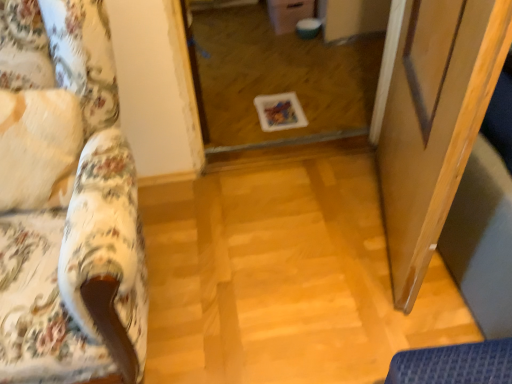
You are a GUI agent. You are given a task and a screenshot of the screen. Output one action in this format:
    pyautogui.click(x=<x>, y=<y>)
    Task: Click on the transparent glass screen door at right
    This screenshot has width=512, height=384.
    Given the screenshot: What is the action you would take?
    pyautogui.click(x=434, y=123)

Describe the element at coordinates (434, 123) in the screenshot. I see `transparent glass screen door at right` at that location.

The image size is (512, 384). In order to click on floral fabric couch at left in this screenshot , I will do `click(64, 196)`.

Where is `transparent glass screen door at right`? This screenshot has height=384, width=512. transparent glass screen door at right is located at coordinates (434, 123).

Does floral fabric couch at left contain transparent glass door at center?

Actually, transparent glass door at center is outside floral fabric couch at left.

Would you say floral fabric couch at left is a long distance from transparent glass door at center?

Yes.

In the scene shown: Looking at their sizes, would you say floral fabric couch at left is wider or thinner than transparent glass door at center?

In the image, floral fabric couch at left appears to be more narrow than transparent glass door at center.

In the scene shown: From the image's perspective, between floral fabric couch at left and transparent glass door at center, which one is located above?

transparent glass door at center, from the image's perspective.

Is transparent glass screen door at right wider than floral fabric couch at left?

No.

From a real-world perspective, is transparent glass screen door at right positioned under floral fabric couch at left based on gravity?

Correct, in the physical world, transparent glass screen door at right is lower than floral fabric couch at left.

How different are the orientations of transparent glass screen door at right and floral fabric couch at left in degrees?

transparent glass screen door at right and floral fabric couch at left are facing 104 degrees away from each other.

Considering the points (497, 20) and (75, 373), which point is in front, point (497, 20) or point (75, 373)?

Positioned in front is point (497, 20).

How far apart are transparent glass screen door at right and transparent glass door at center?

transparent glass screen door at right and transparent glass door at center are 36.99 inches apart.

Is transparent glass screen door at right oriented away from transparent glass door at center?

No, transparent glass screen door at right's orientation is not away from transparent glass door at center.

Is transparent glass screen door at right wider or thinner than transparent glass door at center?

Clearly, transparent glass screen door at right has less width compared to transparent glass door at center.

From a real-world perspective, is transparent glass screen door at right located higher than transparent glass door at center?

Yes, from a real-world perspective, transparent glass screen door at right is above transparent glass door at center.

Can you confirm if floral fabric couch at left is wider than transparent glass screen door at right?

Correct, the width of floral fabric couch at left exceeds that of transparent glass screen door at right.

Is floral fabric couch at left positioned with its back to transparent glass screen door at right?

No, transparent glass screen door at right is not at the back of floral fabric couch at left.

From a real-world perspective, who is located higher, floral fabric couch at left or transparent glass screen door at right?

floral fabric couch at left, from a real-world perspective.

Is point (72, 95) behind point (473, 25)?

Yes, point (72, 95) is behind point (473, 25).

Which of these two, transparent glass door at center or floral fabric couch at left, is bigger?

floral fabric couch at left is bigger.

Who is shorter, transparent glass door at center or floral fabric couch at left?

transparent glass door at center is shorter.

From a real-world perspective, which object stands above the other?

floral fabric couch at left, from a real-world perspective.

Could you tell me if transparent glass door at center is facing transparent glass screen door at right?

No.

Considering the relative sizes of transparent glass door at center and transparent glass screen door at right in the image provided, is transparent glass door at center bigger than transparent glass screen door at right?

Incorrect, transparent glass door at center is not larger than transparent glass screen door at right.

Is transparent glass door at center positioned beyond the bounds of transparent glass screen door at right?

Yes, transparent glass door at center is located beyond the bounds of transparent glass screen door at right.

Consider the image. Is transparent glass door at center behind transparent glass screen door at right?

Yes, transparent glass door at center is behind transparent glass screen door at right.

This screenshot has height=384, width=512. What are the coordinates of `glass door that is on the right side of floral fabric couch at left` in the screenshot? It's located at (278, 77).

At what (x,y) coordinates should I click in order to perform the action: click on screen door located underneath the floral fabric couch at left (from a real-world perspective). Please return your answer as a coordinate pair (x, y). This screenshot has height=384, width=512. Looking at the image, I should click on (434, 123).

Considering their positions, is floral fabric couch at left positioned closer to transparent glass door at center than transparent glass screen door at right?

transparent glass screen door at right is closer to transparent glass door at center.

Based on their spatial positions, is transparent glass screen door at right or floral fabric couch at left further from transparent glass door at center?

Based on the image, floral fabric couch at left appears to be further to transparent glass door at center.

Considering their positions, is transparent glass door at center positioned further to floral fabric couch at left than transparent glass screen door at right?

transparent glass door at center.

Which object lies further to the anchor point transparent glass screen door at right, floral fabric couch at left or transparent glass door at center?

The object further to transparent glass screen door at right is transparent glass door at center.

When comparing their distances from transparent glass screen door at right, does transparent glass door at center or floral fabric couch at left seem closer?

floral fabric couch at left is positioned closer to the anchor transparent glass screen door at right.

Which object lies nearer to the anchor point floral fabric couch at left, transparent glass screen door at right or transparent glass door at center?

The object closer to floral fabric couch at left is transparent glass screen door at right.

At what (x,y) coordinates should I click in order to perform the action: click on screen door between floral fabric couch at left and transparent glass door at center in the front-back direction. Please return your answer as a coordinate pair (x, y). This screenshot has width=512, height=384. Looking at the image, I should click on (434, 123).